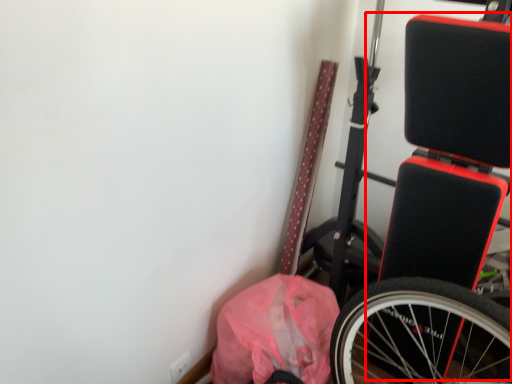
Question: From the image's perspective, where is wide (annotated by the red box) located relative to material?

Choices:
 (A) below
 (B) above

Answer: (B)